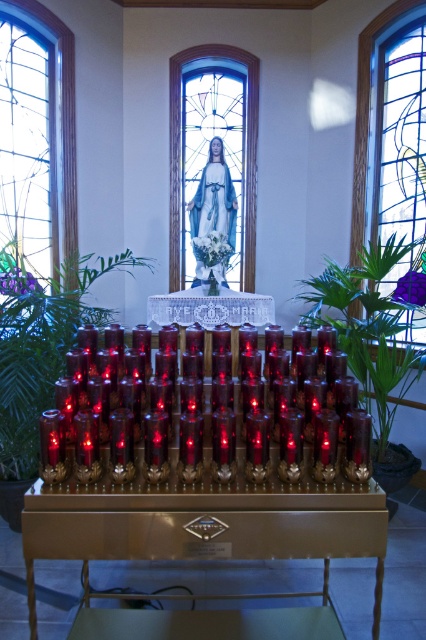
Question: Based on their relative distances, which object is nearer to the clear glass stained glass at left?

Choices:
 (A) translucent glass candle at center
 (B) stained glass window at upper right
 (C) green leafy plant at center

Answer: (C)

Question: Which of the following is the farthest from the observer?

Choices:
 (A) (331, 486)
 (B) (161, 300)
 (C) (14, 435)

Answer: (B)

Question: Is clear glass stained glass at left above blue glass at center?

Choices:
 (A) no
 (B) yes

Answer: (A)

Question: Is gold metallic table at center closer to camera compared to stained glass window at upper right?

Choices:
 (A) no
 (B) yes

Answer: (B)

Question: From the image, what is the correct spatial relationship of gold metallic table at center in relation to green leafy plant at left?

Choices:
 (A) right
 (B) left

Answer: (A)

Question: Estimate the real-world distances between objects in this image. Which object is closer to the white lace table at center?

Choices:
 (A) gold metallic table at center
 (B) green leafy plant at left
 (C) clear glass stained glass at left
 (D) blue glass at center

Answer: (B)